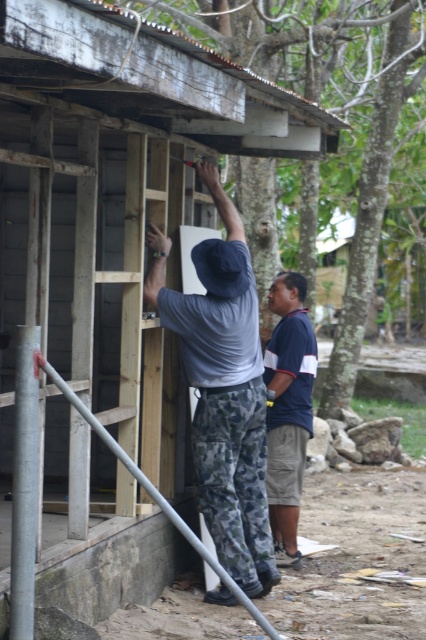
Based on the provided scene, where exactly is the brown wood tree at upper center located in terms of coordinates?

The brown wood tree at upper center is located at point coordinates of (192, 90).

You are a construction supervisor observing the site. You notice the brown wood tree at upper center and the blue striped shirt at center. Which object is located to the right of the other?

The brown wood tree at upper center is positioned on the right side of blue striped shirt at center.